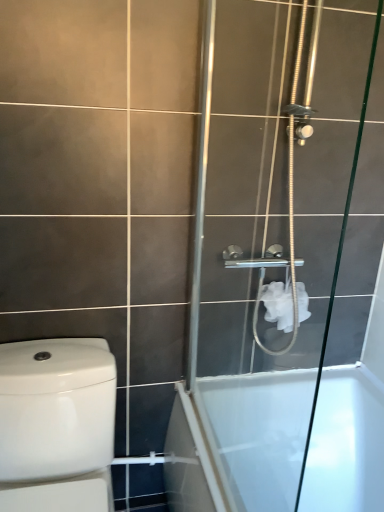
Question: From the image's perspective, is clear glass shower door at right on white glossy toilet at left?

Choices:
 (A) no
 (B) yes

Answer: (B)

Question: From the image's perspective, is clear glass shower door at right under white glossy toilet at left?

Choices:
 (A) yes
 (B) no

Answer: (B)

Question: Is clear glass shower door at right to the left of white glossy toilet at left from the viewer's perspective?

Choices:
 (A) no
 (B) yes

Answer: (A)

Question: Is clear glass shower door at right turned away from white glossy toilet at left?

Choices:
 (A) yes
 (B) no

Answer: (B)

Question: Is clear glass shower door at right thinner than white glossy toilet at left?

Choices:
 (A) no
 (B) yes

Answer: (B)

Question: Is white glossy toilet at left taller or shorter than clear glass shower door at right?

Choices:
 (A) short
 (B) tall

Answer: (A)

Question: From the image's perspective, is white glossy toilet at left located above or below clear glass shower door at right?

Choices:
 (A) above
 (B) below

Answer: (B)

Question: Visually, is white glossy toilet at left positioned to the left or to the right of clear glass shower door at right?

Choices:
 (A) left
 (B) right

Answer: (A)

Question: Looking at their shapes, would you say white glossy toilet at left is wider or thinner than clear glass shower door at right?

Choices:
 (A) thin
 (B) wide

Answer: (B)

Question: Is white glossy bathtub at lower right situated inside white glossy toilet at left or outside?

Choices:
 (A) inside
 (B) outside

Answer: (B)

Question: Considering their positions, is white glossy bathtub at lower right located in front of or behind white glossy toilet at left?

Choices:
 (A) front
 (B) behind

Answer: (B)

Question: From a real-world perspective, is white glossy bathtub at lower right positioned above or below white glossy toilet at left?

Choices:
 (A) above
 (B) below

Answer: (B)

Question: Considering the positions of point (165, 445) and point (31, 500), is point (165, 445) closer or farther from the camera than point (31, 500)?

Choices:
 (A) farther
 (B) closer

Answer: (A)

Question: From a real-world perspective, is white matte toilet paper at upper right positioned above or below white glossy toilet at left?

Choices:
 (A) below
 (B) above

Answer: (B)

Question: From the image's perspective, is white matte toilet paper at upper right above or below white glossy toilet at left?

Choices:
 (A) below
 (B) above

Answer: (B)